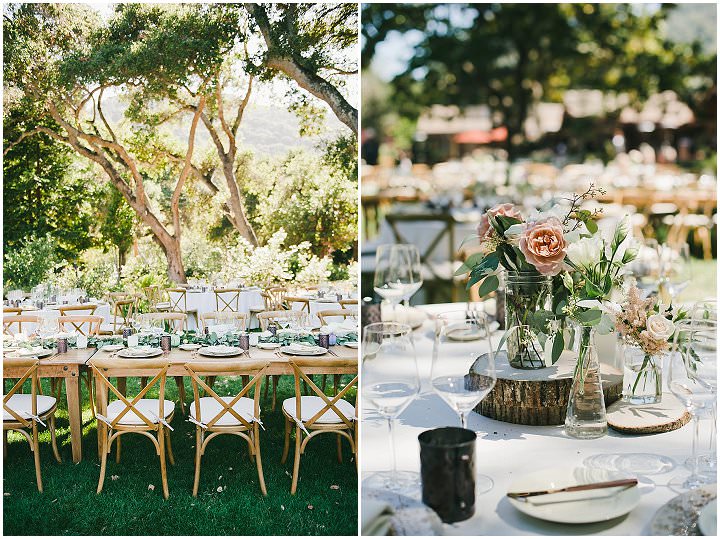
At what (x,y) coordinates should I click in order to perform the action: click on plate. Please return your answer as a coordinate pair (x, y). Looking at the image, I should click on (564, 514).